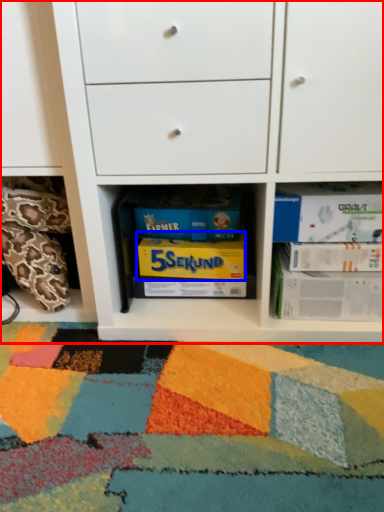
Question: Which point is further to the camera, chest of drawers (highlighted by a red box) or paperback book (highlighted by a blue box)?

Choices:
 (A) chest of drawers
 (B) paperback book

Answer: (B)